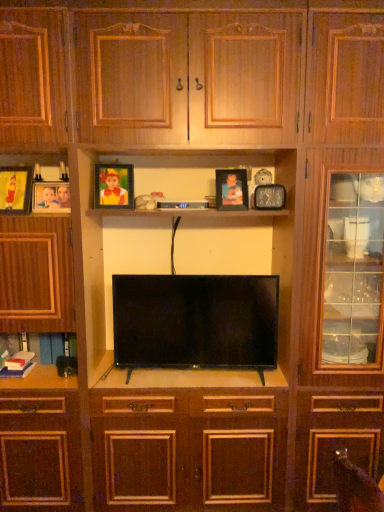
Question: Does matte gold picture frame at upper left, which ranks as the 3th picture frame in right-to-left order, have a greater height compared to matte wooden picture frame at left, arranged as the 1th picture frame when viewed from the left?

Choices:
 (A) no
 (B) yes

Answer: (A)

Question: Is matte gold picture frame at upper left, which is counted as the third picture frame, starting from the left, further to the viewer compared to matte wooden picture frame at left, arranged as the 1th picture frame when viewed from the left?

Choices:
 (A) yes
 (B) no

Answer: (A)

Question: From the image's perspective, is matte gold picture frame at upper left, which is counted as the third picture frame, starting from the left, below matte wooden picture frame at left, which is the fifth picture frame in right-to-left order?

Choices:
 (A) yes
 (B) no

Answer: (B)

Question: Does matte gold picture frame at upper left, which ranks as the 3th picture frame in right-to-left order, appear on the left side of matte wooden picture frame at left, which is the fifth picture frame in right-to-left order?

Choices:
 (A) no
 (B) yes

Answer: (A)

Question: Is matte gold picture frame at upper left, which is counted as the third picture frame, starting from the left, thinner than matte wooden picture frame at left, arranged as the 1th picture frame when viewed from the left?

Choices:
 (A) no
 (B) yes

Answer: (A)

Question: Is matte wooden picture frame at left, which is counted as the 4th picture frame, starting from the right, bigger or smaller than matte gold picture frame at upper left, which ranks as the 3th picture frame in right-to-left order?

Choices:
 (A) big
 (B) small

Answer: (B)

Question: Considering the positions of point (39, 211) and point (104, 181), is point (39, 211) closer or farther from the camera than point (104, 181)?

Choices:
 (A) closer
 (B) farther

Answer: (A)

Question: From the image's perspective, is matte wooden picture frame at left, the 2th picture frame in the left-to-right sequence, located above or below matte gold picture frame at upper left, which is counted as the third picture frame, starting from the left?

Choices:
 (A) below
 (B) above

Answer: (A)

Question: Would you say matte wooden picture frame at left, the 2th picture frame in the left-to-right sequence, is to the left or to the right of matte gold picture frame at upper left, which ranks as the 3th picture frame in right-to-left order, in the picture?

Choices:
 (A) right
 (B) left

Answer: (B)

Question: Is matte wooden picture frame at left, which is the fifth picture frame in right-to-left order, wider or thinner than matte black clock at upper center, the fifth picture frame in the left-to-right sequence?

Choices:
 (A) thin
 (B) wide

Answer: (B)

Question: From the image's perspective, is matte wooden picture frame at left, which is the fifth picture frame in right-to-left order, located above or below matte black clock at upper center, the fifth picture frame in the left-to-right sequence?

Choices:
 (A) above
 (B) below

Answer: (A)

Question: From a real-world perspective, relative to matte black clock at upper center, the fifth picture frame in the left-to-right sequence, is matte wooden picture frame at left, which is the fifth picture frame in right-to-left order, vertically above or below?

Choices:
 (A) below
 (B) above

Answer: (B)

Question: Is matte wooden picture frame at left, arranged as the 1th picture frame when viewed from the left, inside or outside of matte black clock at upper center, the fifth picture frame in the left-to-right sequence?

Choices:
 (A) outside
 (B) inside

Answer: (A)

Question: Considering the positions of flat screen tv at center and matte black picture frame at upper center, arranged as the fourth picture frame when viewed from the left, in the image, is flat screen tv at center bigger or smaller than matte black picture frame at upper center, arranged as the fourth picture frame when viewed from the left,?

Choices:
 (A) small
 (B) big

Answer: (B)

Question: From the image's perspective, is flat screen tv at center above or below matte black picture frame at upper center, arranged as the fourth picture frame when viewed from the left?

Choices:
 (A) below
 (B) above

Answer: (A)